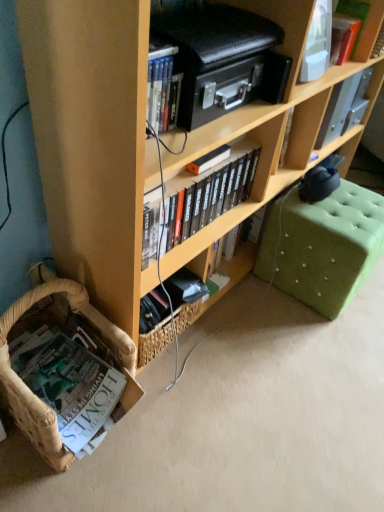
You are a GUI agent. You are given a task and a screenshot of the screen. Output one action in this format:
    pyautogui.click(x=<x>, y=<y>)
    Task: Click on the wooden bookcase at lower left
    
    Given the screenshot: What is the action you would take?
    pyautogui.click(x=93, y=141)

You are a GUI agent. You are given a task and a screenshot of the screen. Output one action in this format:
    pyautogui.click(x=<x>, y=<y>)
    Task: Click on the green tufted ottoman at lower right
    
    Given the screenshot: What is the action you would take?
    pyautogui.click(x=323, y=246)

Find the location of a particular element. Image resolution: width=384 pixels, height=512 pixels. white paper book at lower left, which is the 1th book in bottom-to-top order is located at coordinates (70, 383).

I want to click on hardcover book at upper right, the third book viewed from the left, so (x=353, y=15).

Could you tell me if hardcover book at upper right, the 3th book when ordered from bottom to top, is facing wooden bookcase at lower left?

Yes, hardcover book at upper right, the 3th book when ordered from bottom to top, is aimed at wooden bookcase at lower left.

Is hardcover book at upper right, the 3th book when ordered from bottom to top, in contact with wooden bookcase at lower left?

hardcover book at upper right, the 3th book when ordered from bottom to top, and wooden bookcase at lower left are not in contact.

Would you say hardcover book at upper right, the 3th book when ordered from bottom to top, is outside wooden bookcase at lower left?

No, hardcover book at upper right, the 3th book when ordered from bottom to top, is not outside of wooden bookcase at lower left.

Is wooden bookcase at lower left looking in the opposite direction of white paper book at lower left, arranged as the third book when viewed from the right?

That's not correct — wooden bookcase at lower left is not looking away from white paper book at lower left, arranged as the third book when viewed from the right.

Considering the relative sizes of wooden bookcase at lower left and white paper book at lower left, which is the 1th book in bottom-to-top order, in the image provided, is wooden bookcase at lower left wider than white paper book at lower left, which is the 1th book in bottom-to-top order,?

Yes.

Which is closer, (70, 254) or (53, 336)?

Point (70, 254) is closer to the camera than point (53, 336).

Is wooden bookcase at lower left positioned far away from white paper book at lower left, which is the 1th book in bottom-to-top order?

No.

How distant is wooden bookcase at lower left from hardcover book at upper right, which is the 1th book in right-to-left order?

wooden bookcase at lower left and hardcover book at upper right, which is the 1th book in right-to-left order, are 77.74 centimeters apart.

From a real-world perspective, is wooden bookcase at lower left positioned above or below hardcover book at upper right, which is the 1th book in right-to-left order?

wooden bookcase at lower left is below hardcover book at upper right, which is the 1th book in right-to-left order.

Is wooden bookcase at lower left with hardcover book at upper right, the 3th book when ordered from bottom to top?

No, wooden bookcase at lower left is not next to hardcover book at upper right, the 3th book when ordered from bottom to top.

Consider the image. From the image's perspective, is wooden bookcase at lower left above hardcover book at upper right, the third book viewed from the left?

Incorrect, from the image's perspective, wooden bookcase at lower left is lower than hardcover book at upper right, the third book viewed from the left.

From a real-world perspective, between wooden bookcase at lower left and green tufted ottoman at lower right, who is vertically lower?

green tufted ottoman at lower right, from a real-world perspective.

Looking at this image, can you confirm if wooden bookcase at lower left is bigger than green tufted ottoman at lower right?

Correct, wooden bookcase at lower left is larger in size than green tufted ottoman at lower right.

Is wooden bookcase at lower left beside green tufted ottoman at lower right?

No.

Is black matte bookshelf at center, the second book viewed from the left, shorter than white plastic container at upper right?

Yes, black matte bookshelf at center, the second book viewed from the left, is shorter than white plastic container at upper right.

From the image's perspective, would you say black matte bookshelf at center, the second book when ordered from right to left, is positioned over white plastic container at upper right?

Actually, black matte bookshelf at center, the second book when ordered from right to left, appears below white plastic container at upper right in the image.

From the picture: Does black matte bookshelf at center, positioned as the 2th book in bottom-to-top order, turn towards white plastic container at upper right?

No.

Looking at their sizes, would you say black matte bookshelf at center, the 2th book from the top, is wider or thinner than white plastic container at upper right?

In the image, black matte bookshelf at center, the 2th book from the top, appears to be wider than white plastic container at upper right.

Which object is wider, white paper book at lower left, the 3th book when ordered from top to bottom, or white plastic container at upper right?

Wider between the two is white paper book at lower left, the 3th book when ordered from top to bottom.

Image resolution: width=384 pixels, height=512 pixels. I want to click on shelf above the white paper book at lower left, the 3th book when ordered from top to bottom (from a real-world perspective), so click(298, 42).

Could you measure the distance between white plastic container at upper right and white paper book at lower left, which is the 1th book in bottom-to-top order?

white plastic container at upper right and white paper book at lower left, which is the 1th book in bottom-to-top order, are 3.30 feet apart from each other.

Considering the relative positions of white plastic container at upper right and white paper book at lower left, arranged as the third book when viewed from the right, in the image provided, is white plastic container at upper right to the right of white paper book at lower left, arranged as the third book when viewed from the right, from the viewer's perspective?

Correct, you'll find white plastic container at upper right to the right of white paper book at lower left, arranged as the third book when viewed from the right.

Is white plastic container at upper right smaller than white paper book at lower left, which is the 1th book in bottom-to-top order?

Indeed, white plastic container at upper right has a smaller size compared to white paper book at lower left, which is the 1th book in bottom-to-top order.

Can we say white plastic container at upper right lies outside white paper book at lower left, arranged as the third book when viewed from the right?

Absolutely, white plastic container at upper right is external to white paper book at lower left, arranged as the third book when viewed from the right.

At what (x,y) coordinates should I click in order to perform the action: click on bookcase that appears on the left of hardcover book at upper right, the 3th book when ordered from bottom to top. Please return your answer as a coordinate pair (x, y). Image resolution: width=384 pixels, height=512 pixels. Looking at the image, I should click on (93, 141).

Where is `book that is the 2nd object located below the wooden bookcase at lower left (from the image's perspective)`? This screenshot has width=384, height=512. book that is the 2nd object located below the wooden bookcase at lower left (from the image's perspective) is located at coordinates (70, 383).

Based on the photo, which object lies further to the anchor point black matte bookshelf at center, the 2th book from the top, green tufted ottoman at lower right or hardcover book at upper right, acting as the 1th book starting from the top?

Based on the image, hardcover book at upper right, acting as the 1th book starting from the top, appears to be further to black matte bookshelf at center, the 2th book from the top.

Looking at the image, which one is located further to wooden bookcase at lower left, white plastic container at upper right or green tufted ottoman at lower right?

white plastic container at upper right.

Estimate the real-world distances between objects in this image. Which object is further from hardcover book at upper right, the 3th book when ordered from bottom to top, wooden bookcase at lower left or white plastic container at upper right?

Among the two, wooden bookcase at lower left is located further to hardcover book at upper right, the 3th book when ordered from bottom to top.

When comparing their distances from white plastic container at upper right, does wooden bookcase at lower left or green tufted ottoman at lower right seem further?

Answer: Based on the image, green tufted ottoman at lower right appears to be further to white plastic container at upper right.

When comparing their distances from green tufted ottoman at lower right, does white paper book at lower left, arranged as the third book when viewed from the right, or white plastic container at upper right seem further?

The object further to green tufted ottoman at lower right is white paper book at lower left, arranged as the third book when viewed from the right.

Which object lies further to the anchor point white paper book at lower left, which is the 1th book in bottom-to-top order, white plastic container at upper right or wooden bookcase at lower left?

Among the two, white plastic container at upper right is located further to white paper book at lower left, which is the 1th book in bottom-to-top order.

Looking at the image, which one is located further to wooden bookcase at lower left, white paper book at lower left, the 3th book when ordered from top to bottom, or hardcover book at upper right, which is the 1th book in right-to-left order?

hardcover book at upper right, which is the 1th book in right-to-left order, is further to wooden bookcase at lower left.

Estimate the real-world distances between objects in this image. Which object is closer to green tufted ottoman at lower right, hardcover book at upper right, acting as the 1th book starting from the top, or black matte bookshelf at center, the second book when ordered from right to left?

Among the two, black matte bookshelf at center, the second book when ordered from right to left, is located nearer to green tufted ottoman at lower right.

Identify the location of swivel chair between white plastic container at upper right and white paper book at lower left, the 1th book when ordered from left to right, from top to bottom. (323, 246).

Where is `bookcase situated between white paper book at lower left, which is the 1th book in bottom-to-top order, and green tufted ottoman at lower right from left to right`? bookcase situated between white paper book at lower left, which is the 1th book in bottom-to-top order, and green tufted ottoman at lower right from left to right is located at coordinates (93, 141).

The image size is (384, 512). Identify the location of bookcase between white plastic container at upper right and white paper book at lower left, the 3th book when ordered from top to bottom, in the vertical direction. (93, 141).

Where is `shelf between hardcover book at upper right, acting as the 1th book starting from the top, and black matte bookshelf at center, positioned as the 2th book in bottom-to-top order, vertically`? shelf between hardcover book at upper right, acting as the 1th book starting from the top, and black matte bookshelf at center, positioned as the 2th book in bottom-to-top order, vertically is located at coordinates (298, 42).